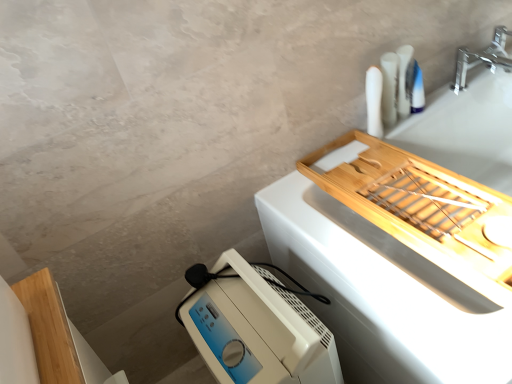
Question: Considering the relative sizes of white plastic toothpaste tube at upper right, acting as the 3th toiletry starting from the left, and natural wood tray at upper right in the image provided, is white plastic toothpaste tube at upper right, acting as the 3th toiletry starting from the left, bigger than natural wood tray at upper right?

Choices:
 (A) no
 (B) yes

Answer: (A)

Question: From the image's perspective, is white plastic toothpaste tube at upper right, acting as the 3th toiletry starting from the left, located beneath natural wood tray at upper right?

Choices:
 (A) yes
 (B) no

Answer: (B)

Question: Is white plastic toothpaste tube at upper right, acting as the 3th toiletry starting from the left, behind natural wood tray at upper right?

Choices:
 (A) no
 (B) yes

Answer: (B)

Question: Is white plastic toothpaste tube at upper right, acting as the 3th toiletry starting from the left, taller than natural wood tray at upper right?

Choices:
 (A) no
 (B) yes

Answer: (A)

Question: Is white plastic toothpaste tube at upper right, which ranks as the 1th toiletry in right-to-left order, not within natural wood tray at upper right?

Choices:
 (A) yes
 (B) no

Answer: (A)

Question: Does white plastic toothpaste tube at upper right, acting as the 3th toiletry starting from the left, come in front of natural wood tray at upper right?

Choices:
 (A) no
 (B) yes

Answer: (A)

Question: Is the surface of white plastic toothpaste tube at upper right, acting as the 3th toiletry starting from the left, in direct contact with white plastic toothbrush at upper right, acting as the first toiletry starting from the left?

Choices:
 (A) yes
 (B) no

Answer: (B)

Question: Is white plastic toothpaste tube at upper right, acting as the 3th toiletry starting from the left, positioned before white plastic toothbrush at upper right, acting as the first toiletry starting from the left?

Choices:
 (A) yes
 (B) no

Answer: (B)

Question: Is white plastic toothpaste tube at upper right, acting as the 3th toiletry starting from the left, wider than white plastic toothbrush at upper right, which is the 3th toiletry from right to left?

Choices:
 (A) no
 (B) yes

Answer: (A)

Question: Would you say white plastic toothpaste tube at upper right, which ranks as the 1th toiletry in right-to-left order, is a long distance from white plastic toothbrush at upper right, which is the 3th toiletry from right to left?

Choices:
 (A) no
 (B) yes

Answer: (A)

Question: From the image's perspective, is white plastic toothpaste tube at upper right, which ranks as the 1th toiletry in right-to-left order, beneath white plastic toothbrush at upper right, acting as the first toiletry starting from the left?

Choices:
 (A) yes
 (B) no

Answer: (B)

Question: Could you tell me if white plastic toothpaste tube at upper right, which ranks as the 1th toiletry in right-to-left order, is facing white plastic toothbrush at upper right, which is the 3th toiletry from right to left?

Choices:
 (A) no
 (B) yes

Answer: (A)

Question: Does silver metallic faucet at upper right appear on the right side of natural wood tray at upper right?

Choices:
 (A) yes
 (B) no

Answer: (A)